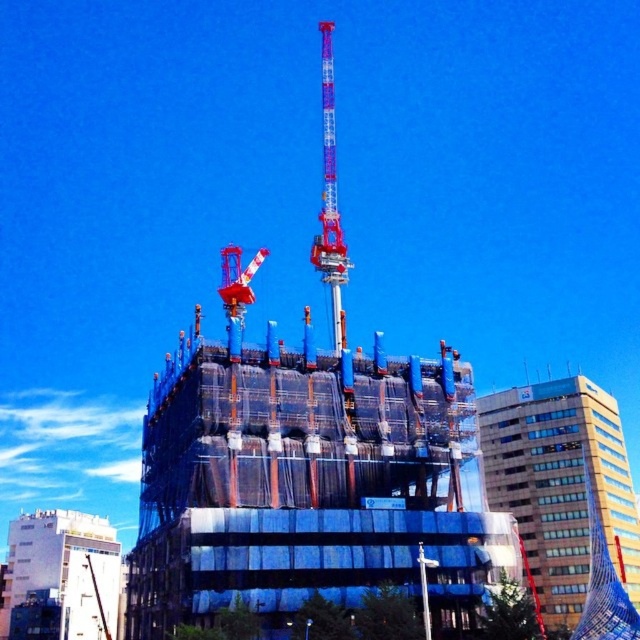
Question: Based on their relative distances, which object is nearer to the white matte building at lower left?

Choices:
 (A) blue glass building at center
 (B) metallic blue tower crane at center

Answer: (B)

Question: Is blue glass building at center behind white matte building at lower left?

Choices:
 (A) yes
 (B) no

Answer: (B)

Question: Can you confirm if blue glass building at center is wider than metallic blue tower crane at center?

Choices:
 (A) no
 (B) yes

Answer: (B)

Question: Which point appears farthest from the camera in this image?

Choices:
 (A) (545, 497)
 (B) (108, 605)

Answer: (B)

Question: Among these points, which one is nearest to the camera?

Choices:
 (A) (627, 564)
 (B) (19, 528)
 (C) (336, 250)

Answer: (C)

Question: Can you confirm if white matte building at lower left is positioned to the right of metallic blue tower crane at center?

Choices:
 (A) no
 (B) yes

Answer: (A)